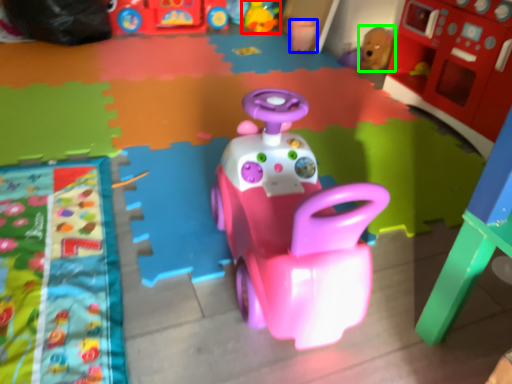
Question: Which object is the closest to the toy (highlighted by a red box)? Choose among these: toy (highlighted by a blue box) or toy (highlighted by a green box).

Choices:
 (A) toy
 (B) toy

Answer: (A)